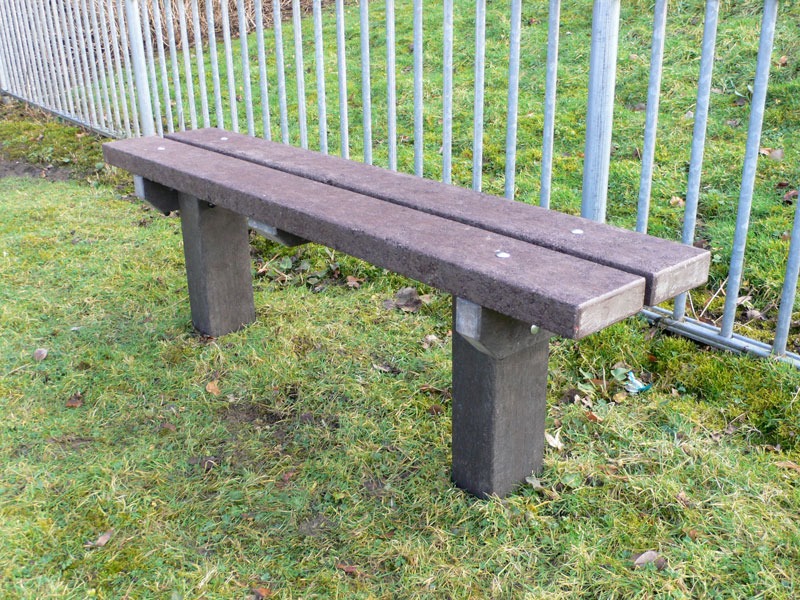
This screenshot has width=800, height=600. In order to click on bench in this screenshot , I will do `click(426, 228)`.